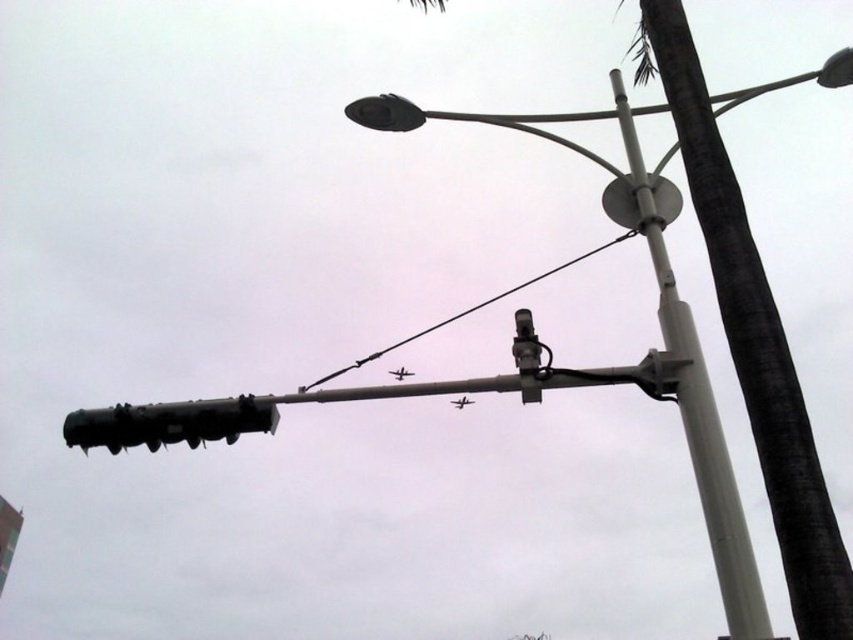
Question: Is white metallic pole at center smaller than black wire at center?

Choices:
 (A) no
 (B) yes

Answer: (B)

Question: Which is farther from the black matte traffic light at left?

Choices:
 (A) black wire at center
 (B) white metallic pole at center
 (C) white plastic street light at upper center

Answer: (B)

Question: Which object is closer to the camera taking this photo?

Choices:
 (A) black matte traffic light at left
 (B) black wire at center
 (C) white plastic street light at upper center

Answer: (C)

Question: Is black matte traffic light at left bigger than black wire at center?

Choices:
 (A) yes
 (B) no

Answer: (B)

Question: Can you confirm if black matte traffic light at left is thinner than black wire at center?

Choices:
 (A) yes
 (B) no

Answer: (A)

Question: Which is nearer to the black wire at center?

Choices:
 (A) white plastic street light at upper center
 (B) black matte traffic light at left

Answer: (B)